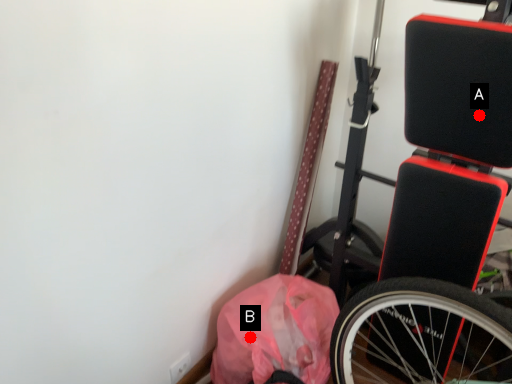
Question: Two points are circled on the image, labeled by A and B beside each circle. Which of the following is the closest to the observer?

Choices:
 (A) A is closer
 (B) B is closer

Answer: (A)